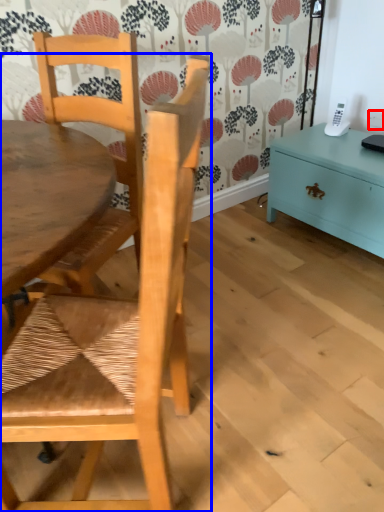
Question: Among these objects, which one is nearest to the camera, power outlet (highlighted by a red box) or chair (highlighted by a blue box)?

Choices:
 (A) power outlet
 (B) chair

Answer: (B)